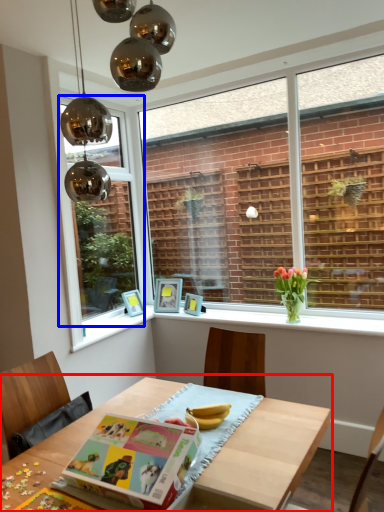
Question: Which point is closer to the camera, table (highlighted by a red box) or window (highlighted by a blue box)?

Choices:
 (A) table
 (B) window

Answer: (A)